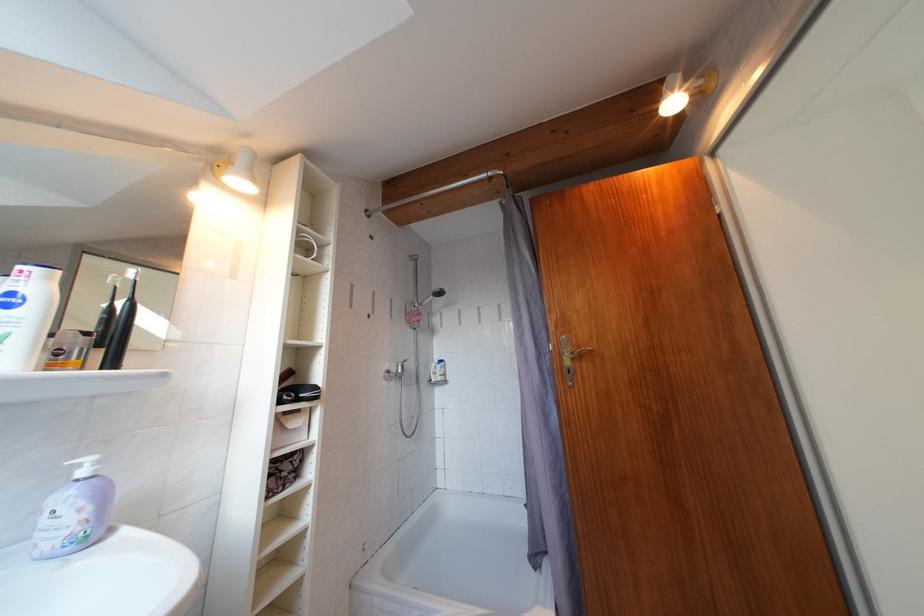
Where is `shower faucet handle`? The image size is (924, 616). shower faucet handle is located at coordinates (395, 371).